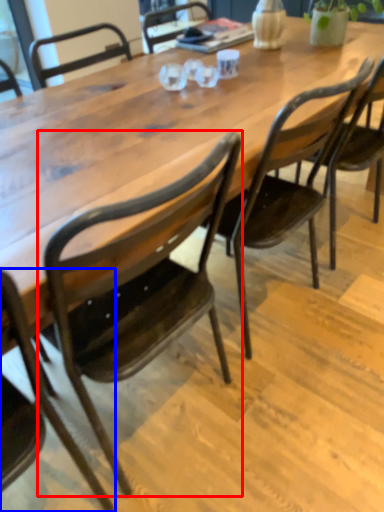
Question: Which of the following is the closest to the observer, chair (highlighted by a red box) or chair (highlighted by a blue box)?

Choices:
 (A) chair
 (B) chair

Answer: (B)